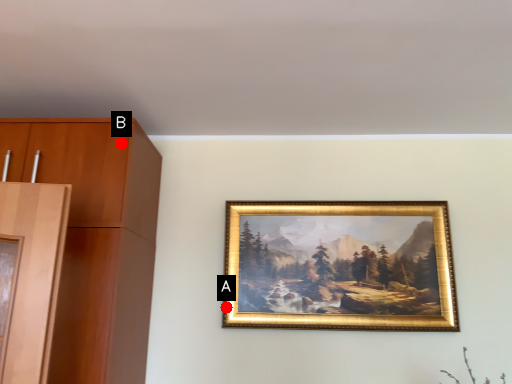
Question: Two points are circled on the image, labeled by A and B beside each circle. Which point is farther from the camera taking this photo?

Choices:
 (A) A is further
 (B) B is further

Answer: (A)